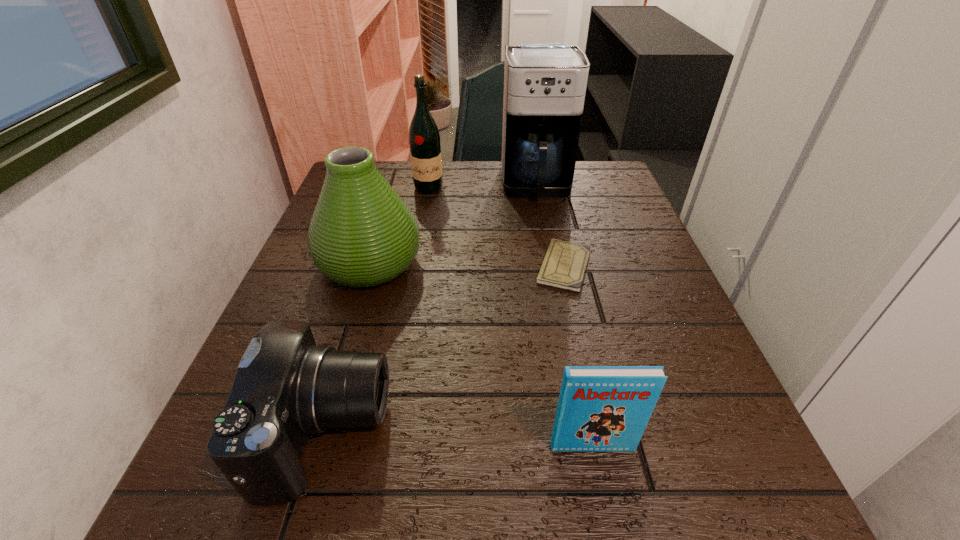
In the image, there is a desktop. Where is `free space at the far edge`? free space at the far edge is located at coordinates (458, 170).

At what (x,y) coordinates should I click in order to perform the action: click on vacant space at the near edge. Please return your answer as a coordinate pair (x, y). Looking at the image, I should click on (495, 496).

Where is `vacant space at the left edge of the desktop`? vacant space at the left edge of the desktop is located at coordinates (331, 296).

At what (x,y) coordinates should I click in order to perform the action: click on free space at the right edge of the desktop. Please return your answer as a coordinate pair (x, y). Looking at the image, I should click on (625, 253).

Locate an element on the screen. The image size is (960, 540). vacant space at the far left corner is located at coordinates (379, 161).

Where is `free space at the far right corner of the desktop`? free space at the far right corner of the desktop is located at coordinates (613, 182).

You are a GUI agent. You are given a task and a screenshot of the screen. Output one action in this format:
    pyautogui.click(x=<x>, y=<y>)
    Task: Click on the vacant space at the near right corner
    The image size is (960, 540).
    Given the screenshot: What is the action you would take?
    pyautogui.click(x=759, y=481)

The width and height of the screenshot is (960, 540). In order to click on free spot between the coffee maker and the second shortest object in this screenshot , I will do tap(431, 309).

Locate an element on the screen. The width and height of the screenshot is (960, 540). vacant point located between the second tallest object and the coffee maker is located at coordinates (482, 187).

At what (x,y) coordinates should I click in order to perform the action: click on blank region between the second tallest object and the coffee maker. Please return your answer as a coordinate pair (x, y). The height and width of the screenshot is (540, 960). Looking at the image, I should click on (482, 187).